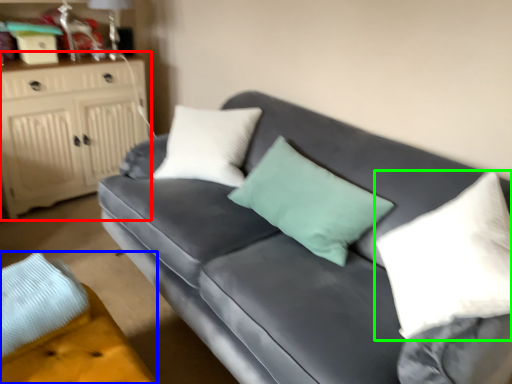
Question: Which object is the farthest from cabinetry (highlighted by a red box)? Choose among these: footrest (highlighted by a blue box) or pillow (highlighted by a green box).

Choices:
 (A) footrest
 (B) pillow

Answer: (B)